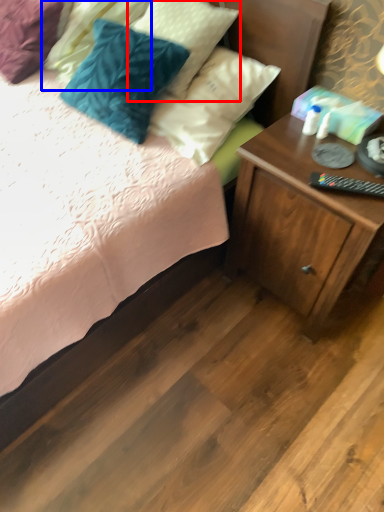
Question: Among these objects, which one is farthest to the camera, pillow (highlighted by a red box) or pillow (highlighted by a blue box)?

Choices:
 (A) pillow
 (B) pillow

Answer: (B)